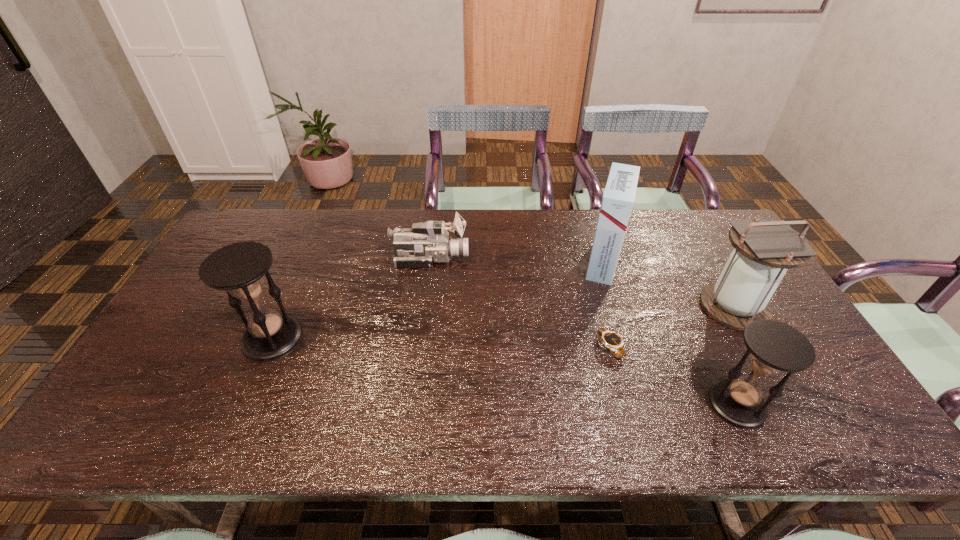
Find the location of `vacant space located on the back of the shorter hourglass`. vacant space located on the back of the shorter hourglass is located at coordinates pyautogui.click(x=708, y=345).

What are the coordinates of `vacant space located on the front of the cigarette case` in the screenshot? It's located at (622, 326).

At what (x,y) coordinates should I click in order to perform the action: click on vacant region located on the front-facing side of the camcorder. Please return your answer as a coordinate pair (x, y). This screenshot has width=960, height=540. Looking at the image, I should click on (491, 258).

Where is `vacant space situated on the left of the watch`? Image resolution: width=960 pixels, height=540 pixels. vacant space situated on the left of the watch is located at coordinates (457, 347).

You are a GUI agent. You are given a task and a screenshot of the screen. Output one action in this format:
    pyautogui.click(x=<x>, y=<y>)
    Task: Click on the vacant space located 0.100m on the left of the lantern
    
    Given the screenshot: What is the action you would take?
    pyautogui.click(x=666, y=307)

At what (x,y) coordinates should I click in order to perform the action: click on cigarette case that is at the far edge. Please return your answer as a coordinate pair (x, y). This screenshot has width=960, height=540. Looking at the image, I should click on (618, 199).

Where is `camcorder that is at the far edge`? The image size is (960, 540). camcorder that is at the far edge is located at coordinates (428, 242).

At what (x,y) coordinates should I click in order to perform the action: click on object present at the near edge. Please return your answer as a coordinate pair (x, y). This screenshot has height=540, width=960. Looking at the image, I should click on (773, 347).

Find the location of a particular element. The image size is (960, 540). object situated at the right edge is located at coordinates (764, 249).

In the image, there is a desktop. Identify the location of vacant space at the far edge. The height and width of the screenshot is (540, 960). (391, 213).